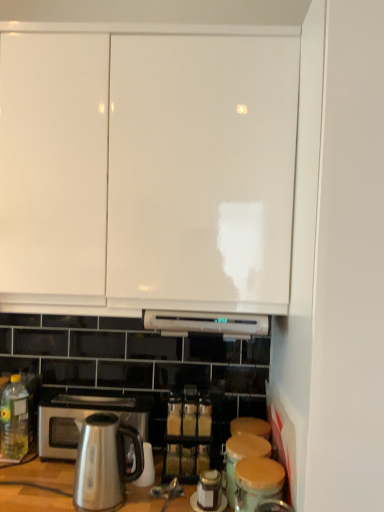
Question: Is yellow translucent bottle at lower left wider or thinner than satin metallic kettle at lower left?

Choices:
 (A) thin
 (B) wide

Answer: (A)

Question: Considering the positions of yellow translucent bottle at lower left and satin metallic kettle at lower left in the image, is yellow translucent bottle at lower left bigger or smaller than satin metallic kettle at lower left?

Choices:
 (A) small
 (B) big

Answer: (A)

Question: Based on their relative distances, which object is farther from the wooden lid canister at lower center, which appears as the second appliance when viewed from the front?

Choices:
 (A) translucent glass spice jar at center
 (B) satin silver microwave oven at lower left
 (C) white glossy cabinet doors at upper center
 (D) matte brown canister at lower right, the 2th appliance from the back
 (E) yellow translucent bottle at lower left

Answer: (C)

Question: Estimate the real-world distances between objects in this image. Which object is farther from the satin silver microwave oven at lower left?

Choices:
 (A) wooden lid canister at lower center, which appears as the second appliance when viewed from the front
 (B) satin metallic kettle at lower left
 (C) translucent glass spice jar at center
 (D) matte brown canister at lower right, the 2th appliance from the back
 (E) yellow translucent bottle at lower left

Answer: (D)